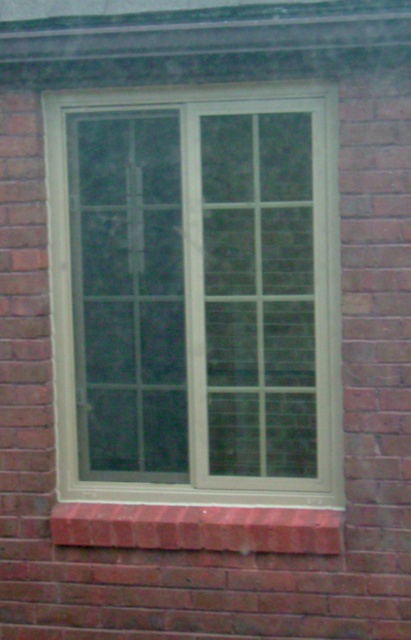
Between point (313, 180) and point (200, 538), which one is positioned behind?

The point (200, 538) is behind.

Can you confirm if white plastic window at center is bigger than red brick window sill at lower center?

Yes, white plastic window at center is bigger than red brick window sill at lower center.

Which is behind, point (228, 179) or point (290, 531)?

Positioned behind is point (228, 179).

You are a GUI agent. You are given a task and a screenshot of the screen. Output one action in this format:
    pyautogui.click(x=<x>, y=<y>)
    Task: Click on the white plastic window at center
    This screenshot has height=640, width=411.
    Given the screenshot: What is the action you would take?
    pyautogui.click(x=196, y=294)